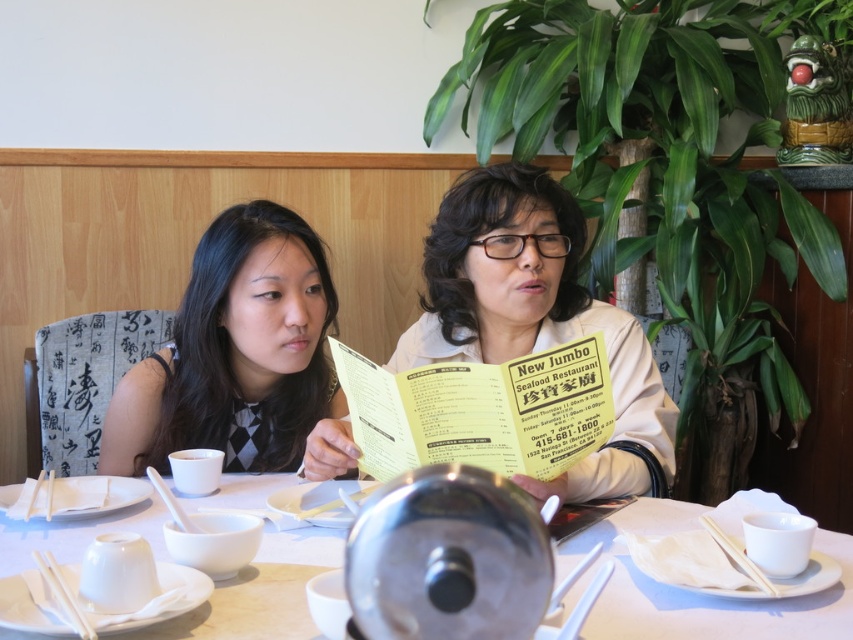
Which is behind, point (242, 308) or point (646, 516)?

Positioned behind is point (242, 308).

Is black textured dress at left taller than white ceramic table at center?

Yes.

Does point (265, 419) lie behind point (84, 528)?

Yes, point (265, 419) is behind point (84, 528).

Where is `black textured dress at left`? The width and height of the screenshot is (853, 640). black textured dress at left is located at coordinates (235, 353).

Is black textured dress at left below yellow paper menu at center?

No, black textured dress at left is not below yellow paper menu at center.

Can you confirm if black textured dress at left is positioned above yellow paper menu at center?

Yes.

What are the coordinates of `black textured dress at left` in the screenshot? It's located at (235, 353).

Does point (637, 364) lie in front of point (242, 353)?

That is True.

Is beige fabric jacket at center taller than black textured dress at left?

Indeed, beige fabric jacket at center has a greater height compared to black textured dress at left.

Does point (647, 403) lie behind point (154, 362)?

No.

At what (x,y) coordinates should I click in order to perform the action: click on beige fabric jacket at center. Please return your answer as a coordinate pair (x, y). The height and width of the screenshot is (640, 853). Looking at the image, I should click on (527, 294).